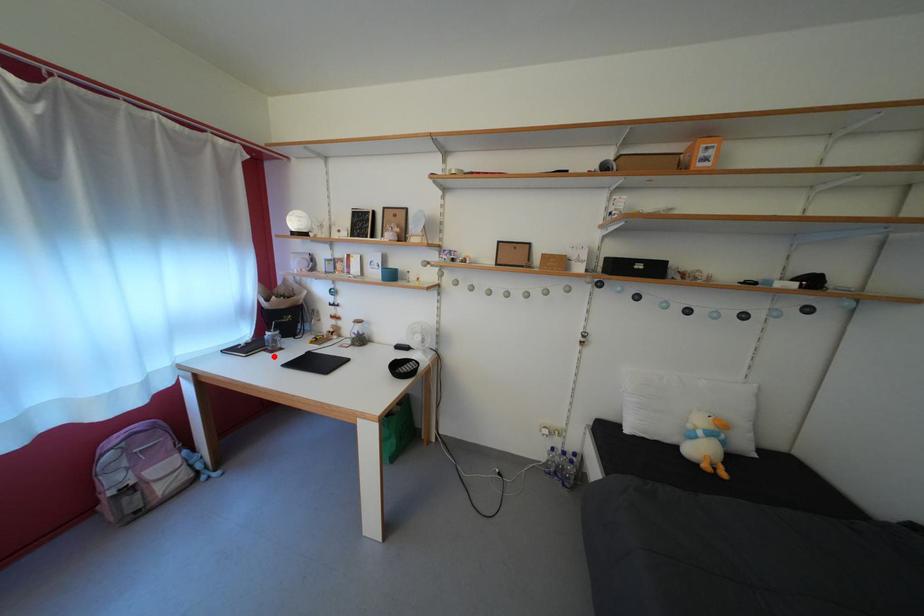
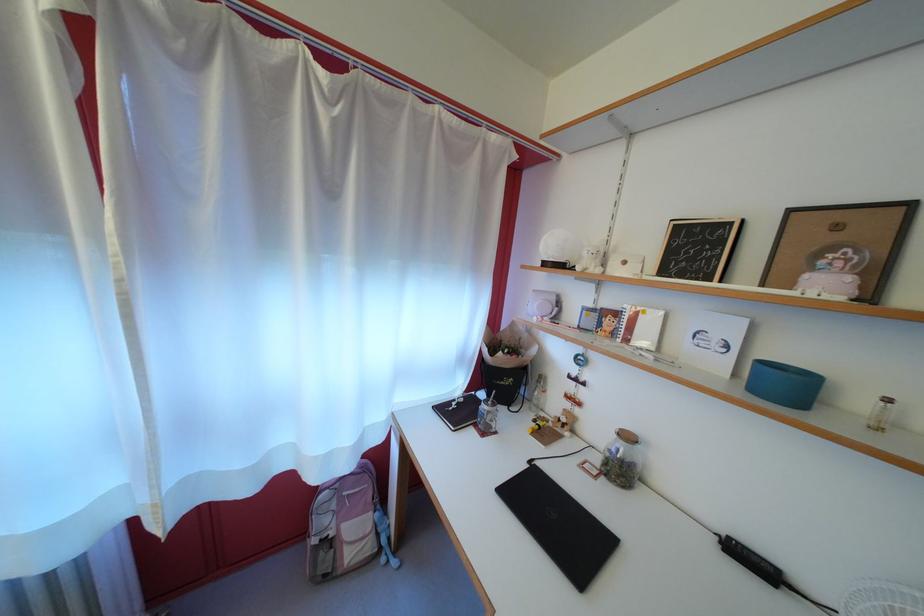
In the second image, find the point that corresponds to the highlighted location in the first image.

(483, 431)